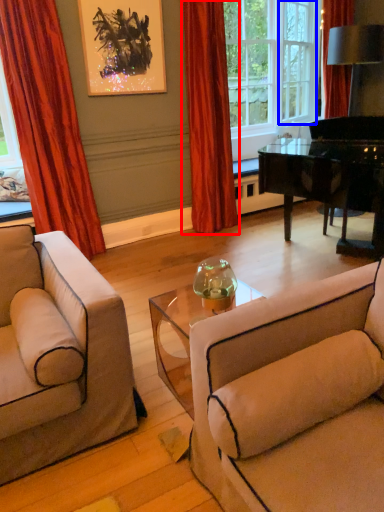
Question: Which object is closer to the camera taking this photo, curtain (highlighted by a red box) or window frame (highlighted by a blue box)?

Choices:
 (A) curtain
 (B) window frame

Answer: (A)